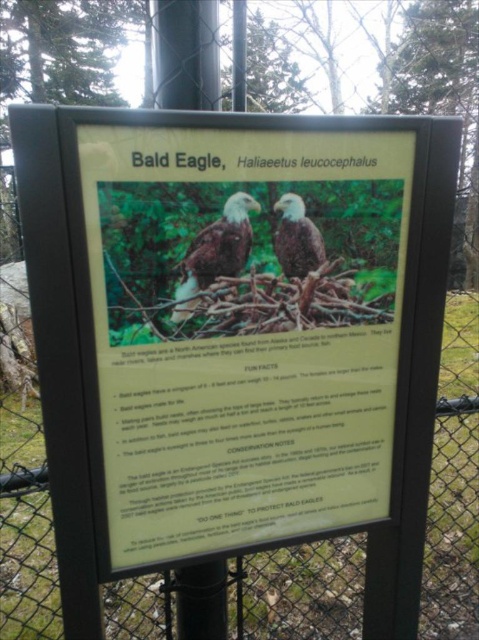
You are a wildlife photographer who wants to capture both the brown feathered eagle at center and the matte brown eagle at center in a single photo. Which eagle should you focus on first to ensure both fit in the frame?

The brown feathered eagle at center is wider than the matte brown eagle at center, so focusing on the wider brown feathered eagle at center first will help ensure both fit in the frame.